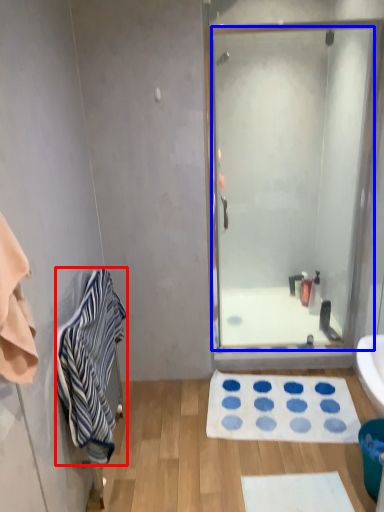
Question: Among these objects, which one is farthest to the camera, towel/napkin (highlighted by a red box) or door (highlighted by a blue box)?

Choices:
 (A) towel/napkin
 (B) door

Answer: (B)